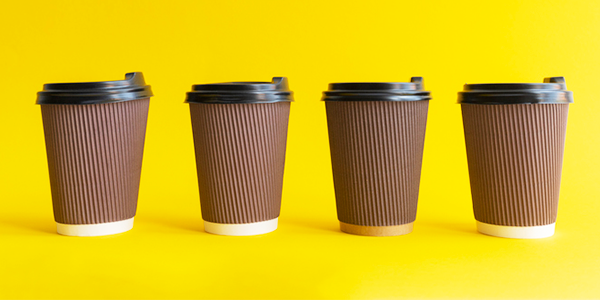
You are a GUI agent. You are given a task and a screenshot of the screen. Output one action in this format:
    pyautogui.click(x=<x>, y=<y>)
    Task: Click on the disposable cup
    This screenshot has width=600, height=300.
    Given the screenshot: What is the action you would take?
    pyautogui.click(x=130, y=129), pyautogui.click(x=266, y=148), pyautogui.click(x=362, y=143), pyautogui.click(x=531, y=146)